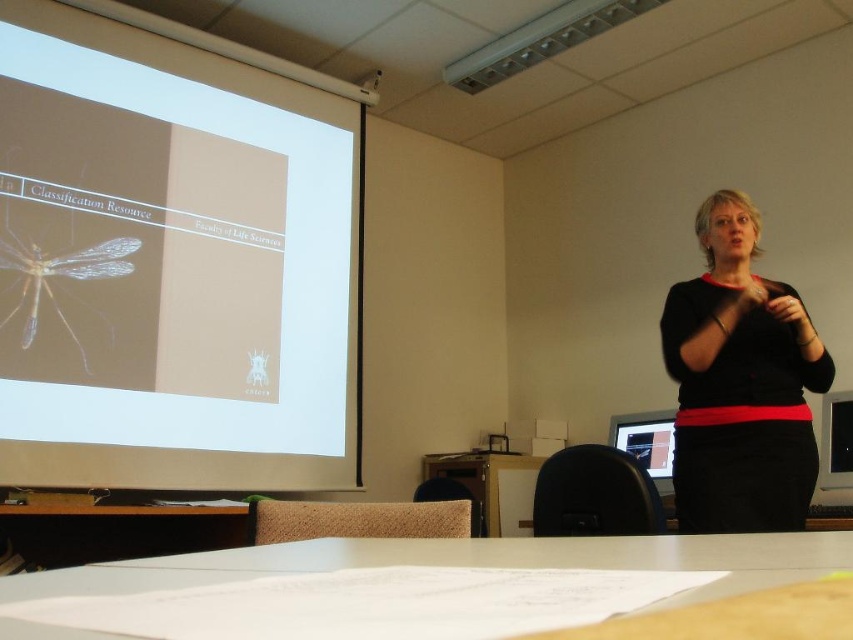
You are a student sitting in the front row of the classroom. You need to walk to the white glossy projection screen at upper left to adjust the slide, but you must pass by the black matte sweater at upper right. Given that you are 1.7 meters tall, will you be able to walk between them without bending?

The white glossy projection screen at upper left and the black matte sweater at upper right are 1.63 meters apart. Since the distance between them is less than your height of 1.7 meters, you would need to bend to pass through the space between them.